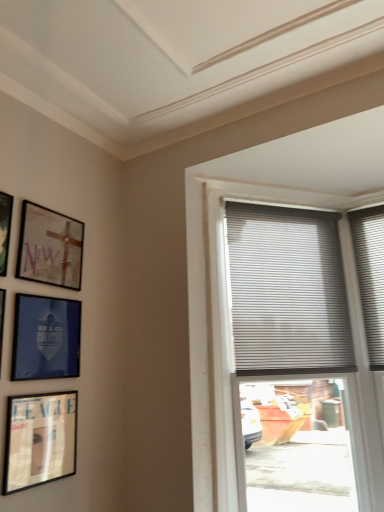
The height and width of the screenshot is (512, 384). What do you see at coordinates (287, 292) in the screenshot?
I see `gray pleated blinds at upper right` at bounding box center [287, 292].

The width and height of the screenshot is (384, 512). What do you see at coordinates (50, 247) in the screenshot?
I see `matte glass picture frame at upper left, which is the 2th picture frame in top-to-bottom order` at bounding box center [50, 247].

Describe the element at coordinates (2, 320) in the screenshot. The height and width of the screenshot is (512, 384). I see `matte black picture frame at left, which appears as the 3th picture frame when ordered from the bottom` at that location.

What do you see at coordinates (40, 439) in the screenshot?
I see `matte black picture frame at lower left, the first picture frame ordered from the bottom` at bounding box center [40, 439].

You are a GUI agent. You are given a task and a screenshot of the screen. Output one action in this format:
    pyautogui.click(x=<x>, y=<y>)
    Task: Click on the gray pleated blinds at upper right
    Image resolution: width=384 pixels, height=512 pixels.
    Given the screenshot: What is the action you would take?
    pyautogui.click(x=287, y=292)

What's the angular difference between matte black picture frame at lower left, positioned as the fifth picture frame in top-to-bottom order, and gray pleated blinds at upper right's facing directions?

The angular difference between matte black picture frame at lower left, positioned as the fifth picture frame in top-to-bottom order, and gray pleated blinds at upper right is 39.4 degrees.

Which is more to the right, matte black picture frame at lower left, the first picture frame ordered from the bottom, or gray pleated blinds at upper right?

From the viewer's perspective, gray pleated blinds at upper right appears more on the right side.

Is matte black picture frame at lower left, the first picture frame ordered from the bottom, behind gray pleated blinds at upper right?

No, it is in front of gray pleated blinds at upper right.

Does matte black picture frame at lower left, the first picture frame ordered from the bottom, have a lesser width compared to gray pleated blinds at upper right?

Indeed, matte black picture frame at lower left, the first picture frame ordered from the bottom, has a lesser width compared to gray pleated blinds at upper right.

Is point (336, 231) positioned behind point (3, 255)?

Yes.

Can you see gray pleated blinds at upper right touching matte black picture frame at upper left, the 1th picture frame from the top?

No, gray pleated blinds at upper right is not making contact with matte black picture frame at upper left, the 1th picture frame from the top.

Does gray pleated blinds at upper right have a lesser width compared to matte black picture frame at upper left, the 1th picture frame from the top?

No, gray pleated blinds at upper right is not thinner than matte black picture frame at upper left, the 1th picture frame from the top.

Looking at this image, what's the angular difference between gray pleated blinds at upper right and matte black picture frame at upper left, the 1th picture frame from the top,'s facing directions?

39.4 degrees separate the facing orientations of gray pleated blinds at upper right and matte black picture frame at upper left, the 1th picture frame from the top.

Is matte glass picture frame at upper left, the fourth picture frame when ordered from bottom to top, in front of or behind gray pleated blinds at upper right in the image?

Visually, matte glass picture frame at upper left, the fourth picture frame when ordered from bottom to top, is located in front of gray pleated blinds at upper right.

Consider the image. Which of these two, matte glass picture frame at upper left, the fourth picture frame when ordered from bottom to top, or gray pleated blinds at upper right, is wider?

gray pleated blinds at upper right is wider.

Can you tell me how much matte glass picture frame at upper left, the fourth picture frame when ordered from bottom to top, and gray pleated blinds at upper right differ in facing direction?

They differ by 39.4 degrees in their facing directions.

Between matte glass picture frame at upper left, which is the 2th picture frame in top-to-bottom order, and gray pleated blinds at upper right, which one has smaller size?

Smaller between the two is matte glass picture frame at upper left, which is the 2th picture frame in top-to-bottom order.

Looking at this image, which point is more forward, (x=35, y=256) or (x=65, y=470)?

The point (x=65, y=470) is closer.

Does matte glass picture frame at upper left, the fourth picture frame when ordered from bottom to top, have a greater width compared to matte black picture frame at lower left, positioned as the fifth picture frame in top-to-bottom order?

Incorrect, the width of matte glass picture frame at upper left, the fourth picture frame when ordered from bottom to top, does not surpass that of matte black picture frame at lower left, positioned as the fifth picture frame in top-to-bottom order.

How much distance is there between matte glass picture frame at upper left, the fourth picture frame when ordered from bottom to top, and matte black picture frame at lower left, positioned as the fifth picture frame in top-to-bottom order?

A distance of 23.82 inches exists between matte glass picture frame at upper left, the fourth picture frame when ordered from bottom to top, and matte black picture frame at lower left, positioned as the fifth picture frame in top-to-bottom order.

In terms of height, does matte glass picture frame at upper left, which is the 2th picture frame in top-to-bottom order, look taller or shorter compared to matte black picture frame at lower left, the first picture frame ordered from the bottom?

matte glass picture frame at upper left, which is the 2th picture frame in top-to-bottom order, is shorter than matte black picture frame at lower left, the first picture frame ordered from the bottom.

Who is taller, matte black picture frame at upper left, which appears as the fifth picture frame when ordered from the bottom, or gray pleated blinds at upper right?

Standing taller between the two is gray pleated blinds at upper right.

I want to click on window blind to the right of matte black picture frame at upper left, the 1th picture frame from the top, so click(287, 292).

Is matte black picture frame at upper left, which appears as the fifth picture frame when ordered from the bottom, surrounding gray pleated blinds at upper right?

No.

From the image's perspective, between blue glossy picture frame at upper left, which is counted as the second picture frame, starting from the bottom, and matte glass picture frame at upper left, which is the 2th picture frame in top-to-bottom order, who is located below?

From the image's view, blue glossy picture frame at upper left, which is counted as the second picture frame, starting from the bottom, is below.

Are blue glossy picture frame at upper left, the fourth picture frame in the top-to-bottom sequence, and matte glass picture frame at upper left, the fourth picture frame when ordered from bottom to top, beside each other?

No, blue glossy picture frame at upper left, the fourth picture frame in the top-to-bottom sequence, is not making contact with matte glass picture frame at upper left, the fourth picture frame when ordered from bottom to top.

Based on the photo, is blue glossy picture frame at upper left, the fourth picture frame in the top-to-bottom sequence, further to camera compared to matte glass picture frame at upper left, which is the 2th picture frame in top-to-bottom order?

No, blue glossy picture frame at upper left, the fourth picture frame in the top-to-bottom sequence, is in front of matte glass picture frame at upper left, which is the 2th picture frame in top-to-bottom order.

From a real-world perspective, which object rests below the other?

blue glossy picture frame at upper left, which is counted as the second picture frame, starting from the bottom, from a real-world perspective.

Can you confirm if matte black picture frame at left, which is the 3th picture frame from top to bottom, is bigger than matte black picture frame at lower left, the first picture frame ordered from the bottom?

Yes.

From the image's perspective, between matte black picture frame at left, which appears as the 3th picture frame when ordered from the bottom, and matte black picture frame at lower left, the first picture frame ordered from the bottom, which one is located above?

matte black picture frame at left, which appears as the 3th picture frame when ordered from the bottom, from the image's perspective.

Is matte black picture frame at lower left, the first picture frame ordered from the bottom, completely or partially inside matte black picture frame at left, which is the 3th picture frame from top to bottom?

Definitely not — matte black picture frame at lower left, the first picture frame ordered from the bottom, is not inside matte black picture frame at left, which is the 3th picture frame from top to bottom.

Is matte black picture frame at left, which is the 3th picture frame from top to bottom, in contact with matte black picture frame at lower left, the first picture frame ordered from the bottom?

They are not placed beside each other.

Identify the location of window blind lying above the matte black picture frame at lower left, the first picture frame ordered from the bottom (from the image's perspective). The width and height of the screenshot is (384, 512). click(287, 292).

At what (x,y) coordinates should I click in order to perform the action: click on the 2nd picture frame above the gray pleated blinds at upper right (from a real-world perspective). Please return your answer as a coordinate pair (x, y). This screenshot has height=512, width=384. Looking at the image, I should click on (5, 229).

Estimate the real-world distances between objects in this image. Which object is closer to matte black picture frame at lower left, positioned as the fifth picture frame in top-to-bottom order, matte black picture frame at upper left, which appears as the fifth picture frame when ordered from the bottom, or matte glass picture frame at upper left, which is the 2th picture frame in top-to-bottom order?

matte glass picture frame at upper left, which is the 2th picture frame in top-to-bottom order, lies closer to matte black picture frame at lower left, positioned as the fifth picture frame in top-to-bottom order, than the other object.

Looking at the image, which one is located closer to blue glossy picture frame at upper left, the fourth picture frame in the top-to-bottom sequence, gray pleated blinds at upper right or matte glass picture frame at upper left, which is the 2th picture frame in top-to-bottom order?

matte glass picture frame at upper left, which is the 2th picture frame in top-to-bottom order.

Based on their spatial positions, is matte glass picture frame at upper left, the fourth picture frame when ordered from bottom to top, or matte black picture frame at left, which appears as the 3th picture frame when ordered from the bottom, further from blue glossy picture frame at upper left, which is counted as the second picture frame, starting from the bottom?

matte glass picture frame at upper left, the fourth picture frame when ordered from bottom to top.

Based on the photo, which object lies further to the anchor point matte glass picture frame at upper left, the fourth picture frame when ordered from bottom to top, gray pleated blinds at upper right or blue glossy picture frame at upper left, the fourth picture frame in the top-to-bottom sequence?

gray pleated blinds at upper right lies further to matte glass picture frame at upper left, the fourth picture frame when ordered from bottom to top, than the other object.

From the image, which object appears to be nearer to matte glass picture frame at upper left, the fourth picture frame when ordered from bottom to top, matte black picture frame at upper left, which appears as the fifth picture frame when ordered from the bottom, or blue glossy picture frame at upper left, which is counted as the second picture frame, starting from the bottom?

matte black picture frame at upper left, which appears as the fifth picture frame when ordered from the bottom, is positioned closer to the anchor matte glass picture frame at upper left, the fourth picture frame when ordered from bottom to top.

Looking at the image, which one is located closer to gray pleated blinds at upper right, matte black picture frame at left, which appears as the 3th picture frame when ordered from the bottom, or blue glossy picture frame at upper left, which is counted as the second picture frame, starting from the bottom?

blue glossy picture frame at upper left, which is counted as the second picture frame, starting from the bottom, is positioned closer to the anchor gray pleated blinds at upper right.

Considering their positions, is matte black picture frame at lower left, the first picture frame ordered from the bottom, positioned closer to matte glass picture frame at upper left, the fourth picture frame when ordered from bottom to top, than gray pleated blinds at upper right?

matte black picture frame at lower left, the first picture frame ordered from the bottom.

Looking at the image, which one is located further to matte black picture frame at lower left, the first picture frame ordered from the bottom, matte glass picture frame at upper left, which is the 2th picture frame in top-to-bottom order, or gray pleated blinds at upper right?

The object further to matte black picture frame at lower left, the first picture frame ordered from the bottom, is gray pleated blinds at upper right.

Where is `picture frame between blue glossy picture frame at upper left, which is counted as the second picture frame, starting from the bottom, and gray pleated blinds at upper right, in the horizontal direction`? The height and width of the screenshot is (512, 384). picture frame between blue glossy picture frame at upper left, which is counted as the second picture frame, starting from the bottom, and gray pleated blinds at upper right, in the horizontal direction is located at coordinates (40, 439).

You are a GUI agent. You are given a task and a screenshot of the screen. Output one action in this format:
    pyautogui.click(x=<x>, y=<y>)
    Task: Click on the picture frame between matte black picture frame at left, which is the 3th picture frame from top to bottom, and matte black picture frame at lower left, positioned as the fifth picture frame in top-to-bottom order, in the vertical direction
    The width and height of the screenshot is (384, 512).
    Given the screenshot: What is the action you would take?
    pyautogui.click(x=46, y=338)